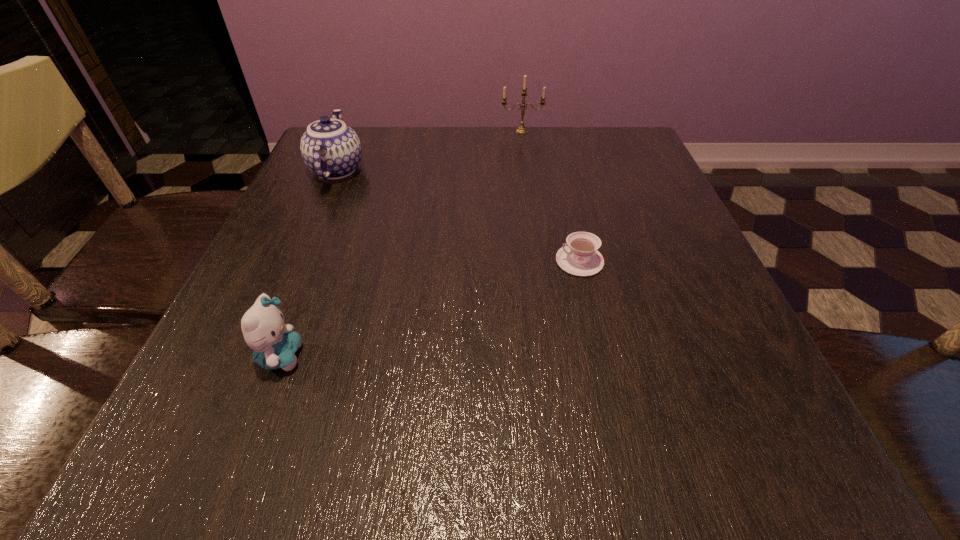
Locate an element on the screen. This screenshot has width=960, height=540. vacant space at the right edge of the desktop is located at coordinates (663, 384).

Locate an element on the screen. vacant space at the far right corner of the desktop is located at coordinates (646, 156).

You are a GUI agent. You are given a task and a screenshot of the screen. Output one action in this format:
    pyautogui.click(x=<x>, y=<y>)
    Task: Click on the free space between the kitten and the candle
    The width and height of the screenshot is (960, 540).
    Given the screenshot: What is the action you would take?
    pyautogui.click(x=401, y=244)

Locate an element on the screen. The width and height of the screenshot is (960, 540). vacant region between the shortest object and the second shortest object is located at coordinates (430, 308).

Locate an element on the screen. unoccupied position between the second nearest object and the second shortest object is located at coordinates (430, 308).

At what (x,y) coordinates should I click in order to perform the action: click on free space that is in between the candle and the teacup. Please return your answer as a coordinate pair (x, y). This screenshot has width=960, height=540. Looking at the image, I should click on (551, 196).

At what (x,y) coordinates should I click in order to perform the action: click on free area in between the candle and the shortest object. Please return your answer as a coordinate pair (x, y). Image resolution: width=960 pixels, height=540 pixels. Looking at the image, I should click on (551, 196).

Find the location of a particular element. empty space that is in between the shortest object and the third nearest object is located at coordinates (458, 215).

I want to click on vacant area between the second nearest object and the farthest object, so click(x=551, y=196).

Locate an element on the screen. blank region between the shortest object and the farthest object is located at coordinates (551, 196).